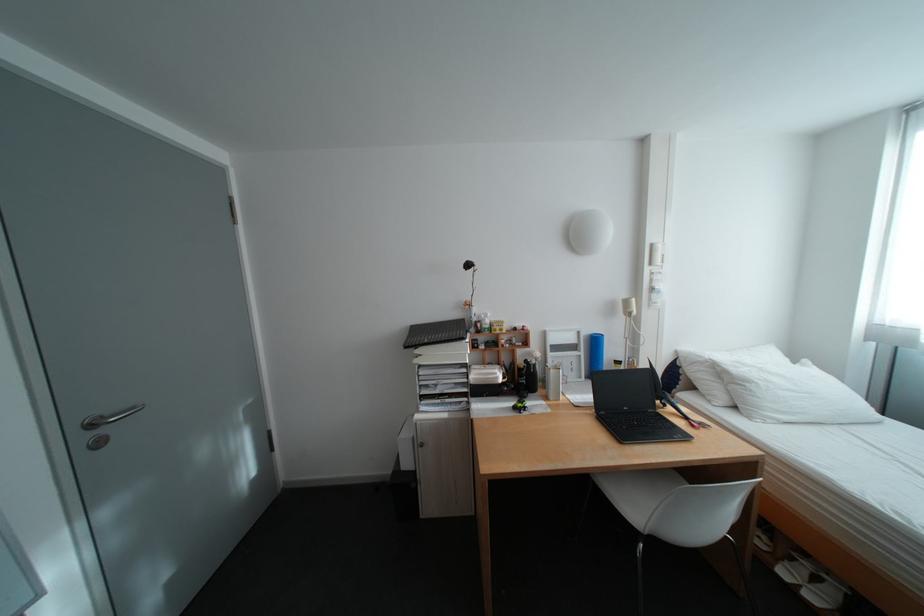
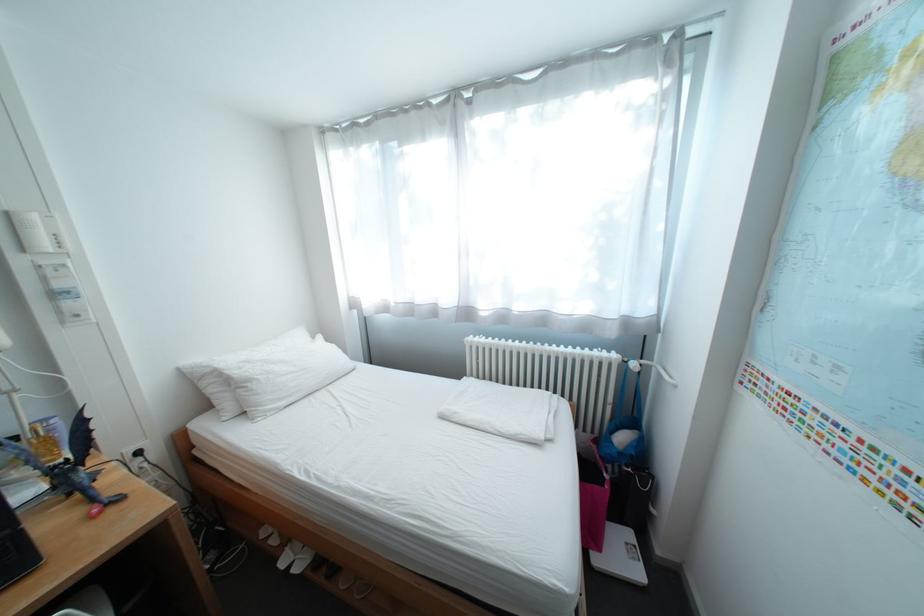
The point at (761, 384) is marked in the first image. Where is the corresponding point in the second image?

(263, 383)